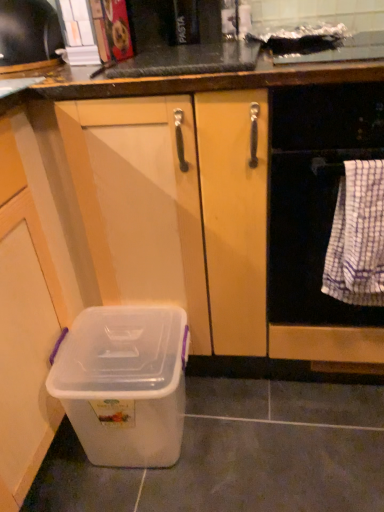
Locate an element on the screen. This screenshot has width=384, height=512. white woven towel at right is located at coordinates (316, 218).

Image resolution: width=384 pixels, height=512 pixels. What do you see at coordinates (125, 383) in the screenshot? I see `transparent plastic storage box at lower left` at bounding box center [125, 383].

Locate an element on the screen. The image size is (384, 512). white woven towel at right is located at coordinates (316, 218).

From a real-world perspective, is transparent plastic storage box at lower left under white checkered towel at right?

Indeed, from a real-world perspective, transparent plastic storage box at lower left is positioned beneath white checkered towel at right.

Between transparent plastic storage box at lower left and white checkered towel at right, which one has larger size?

transparent plastic storage box at lower left.

From the image's perspective, is transparent plastic storage box at lower left located above or below white checkered towel at right?

From the image's perspective, transparent plastic storage box at lower left appears below white checkered towel at right.

Does transparent plastic storage box at lower left have a lesser height compared to white checkered towel at right?

Result: Yes.

Does white checkered towel at right turn towards transparent plastic storage box at lower left?

No, white checkered towel at right is not aimed at transparent plastic storage box at lower left.

Can you confirm if white checkered towel at right is positioned to the right of transparent plastic storage box at lower left?

Yes, white checkered towel at right is to the right of transparent plastic storage box at lower left.

Which object is more forward, white checkered towel at right or transparent plastic storage box at lower left?

white checkered towel at right is more forward.

Who is shorter, white woven towel at right or transparent plastic storage box at lower left?

Standing shorter between the two is transparent plastic storage box at lower left.

Which of these two, white woven towel at right or transparent plastic storage box at lower left, is thinner?

Thinner between the two is transparent plastic storage box at lower left.

Can you see white woven towel at right touching transparent plastic storage box at lower left?

No, white woven towel at right is not touching transparent plastic storage box at lower left.

From a real-world perspective, is white woven towel at right on top of transparent plastic storage box at lower left?

Yes, from a real-world perspective, white woven towel at right is above transparent plastic storage box at lower left.

Is white checkered towel at right closer to camera compared to white woven towel at right?

That is False.

Considering the sizes of objects white checkered towel at right and white woven towel at right in the image provided, who is smaller, white checkered towel at right or white woven towel at right?

Smaller between the two is white checkered towel at right.

From the image's perspective, does white checkered towel at right appear higher than white woven towel at right?

No.

How many degrees apart are the facing directions of white checkered towel at right and white woven towel at right?

0.000274 degrees.

In order to click on home appliance that appears below the metallic silver toaster at upper left (from a real-world perspective) in this screenshot , I will do `click(316, 218)`.

Is metallic silver toaster at upper left at the back of white woven towel at right?

That's not correct — white woven towel at right is not looking away from metallic silver toaster at upper left.

Can you tell me how much white woven towel at right and metallic silver toaster at upper left differ in facing direction?

white woven towel at right and metallic silver toaster at upper left are facing 2.81 degrees away from each other.

Can you confirm if white woven towel at right is shorter than metallic silver toaster at upper left?

No.

Is metallic silver toaster at upper left closer to camera compared to transparent plastic storage box at lower left?

No, it is not.

From the picture: Does metallic silver toaster at upper left touch transparent plastic storage box at lower left?

No.

From a real-world perspective, is metallic silver toaster at upper left under transparent plastic storage box at lower left?

Incorrect, from a real-world perspective, metallic silver toaster at upper left is higher than transparent plastic storage box at lower left.

Is metallic silver toaster at upper left situated inside transparent plastic storage box at lower left or outside?

metallic silver toaster at upper left cannot be found inside transparent plastic storage box at lower left.

From a real-world perspective, which is physically above, metallic silver toaster at upper left or white woven towel at right?

metallic silver toaster at upper left.

Which of these two, metallic silver toaster at upper left or white woven towel at right, is bigger?

With larger size is white woven towel at right.

Which point is more distant from viewer, (22, 15) or (271, 327)?

The point (271, 327) is farther.

Which is more to the left, metallic silver toaster at upper left or white woven towel at right?

metallic silver toaster at upper left is more to the left.

Where is `blanket that appears above the transparent plastic storage box at lower left (from the image's perspective)`? blanket that appears above the transparent plastic storage box at lower left (from the image's perspective) is located at coordinates (357, 237).

Image resolution: width=384 pixels, height=512 pixels. I want to click on storage box located on the left of white checkered towel at right, so point(125,383).

Based on their spatial positions, is white checkered towel at right or metallic silver toaster at upper left further from transparent plastic storage box at lower left?

metallic silver toaster at upper left is further to transparent plastic storage box at lower left.

Estimate the real-world distances between objects in this image. Which object is further from white checkered towel at right, white woven towel at right or transparent plastic storage box at lower left?

transparent plastic storage box at lower left lies further to white checkered towel at right than the other object.

When comparing their distances from white woven towel at right, does metallic silver toaster at upper left or transparent plastic storage box at lower left seem further?

The object further to white woven towel at right is metallic silver toaster at upper left.

Looking at the image, which one is located closer to transparent plastic storage box at lower left, white checkered towel at right or white woven towel at right?

white woven towel at right is positioned closer to the anchor transparent plastic storage box at lower left.

Looking at the image, which one is located closer to metallic silver toaster at upper left, transparent plastic storage box at lower left or white checkered towel at right?

transparent plastic storage box at lower left is closer to metallic silver toaster at upper left.

Looking at the image, which one is located closer to white woven towel at right, transparent plastic storage box at lower left or metallic silver toaster at upper left?

Among the two, transparent plastic storage box at lower left is located nearer to white woven towel at right.

In the scene shown: Estimate the real-world distances between objects in this image. Which object is closer to white woven towel at right, transparent plastic storage box at lower left or white checkered towel at right?

The object closer to white woven towel at right is white checkered towel at right.

Which object lies nearer to the anchor point white woven towel at right, white checkered towel at right or metallic silver toaster at upper left?

white checkered towel at right lies closer to white woven towel at right than the other object.

I want to click on blanket between transparent plastic storage box at lower left and white woven towel at right, so click(357, 237).

Identify the location of home appliance between metallic silver toaster at upper left and transparent plastic storage box at lower left in the vertical direction. (316, 218).

At what (x,y) coordinates should I click in order to perform the action: click on blanket between metallic silver toaster at upper left and white woven towel at right from left to right. Please return your answer as a coordinate pair (x, y). The height and width of the screenshot is (512, 384). Looking at the image, I should click on (357, 237).

Where is `blanket between metallic silver toaster at upper left and transparent plastic storage box at lower left vertically`? blanket between metallic silver toaster at upper left and transparent plastic storage box at lower left vertically is located at coordinates (357, 237).